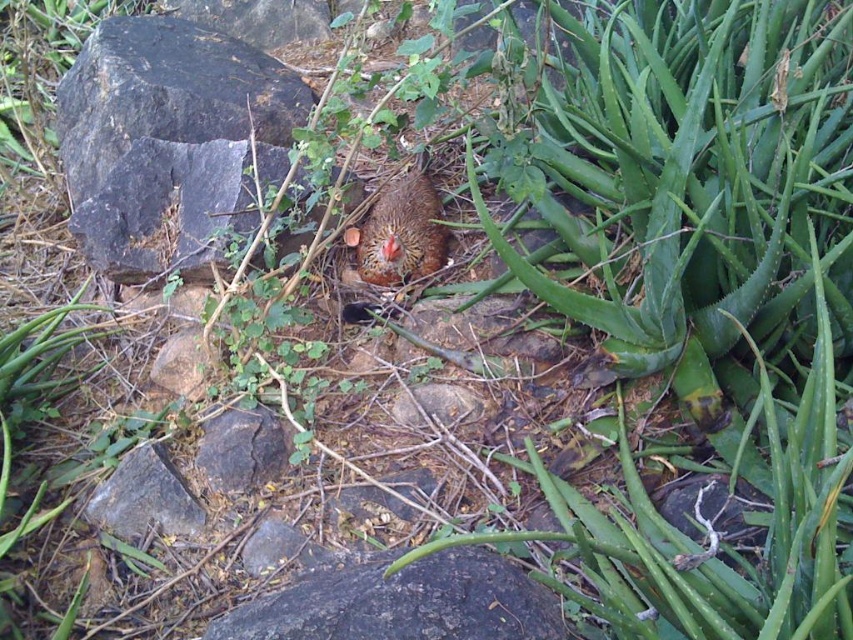
Question: Which object appears farthest from the camera in this image?

Choices:
 (A) black rough rock at center
 (B) brown speckled chicken at center

Answer: (B)

Question: Can you confirm if black rough rock at center is positioned to the right of brown speckled chicken at center?

Choices:
 (A) no
 (B) yes

Answer: (B)

Question: Observing the image, what is the correct spatial positioning of black rough rock at center in reference to brown speckled chicken at center?

Choices:
 (A) above
 (B) below

Answer: (B)

Question: Which point is farther to the camera?

Choices:
 (A) brown speckled chicken at center
 (B) black rough rock at center

Answer: (A)

Question: Which object appears farthest from the camera in this image?

Choices:
 (A) brown speckled chicken at center
 (B) black rough rock at center

Answer: (A)

Question: Can you confirm if black rough rock at center is thinner than brown speckled chicken at center?

Choices:
 (A) yes
 (B) no

Answer: (B)